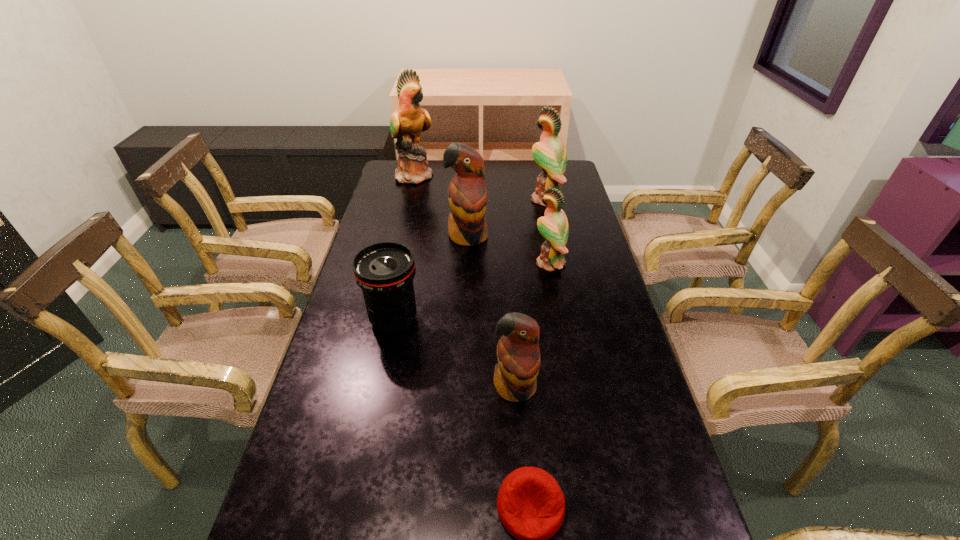
Where is `the biggest green parrot`? the biggest green parrot is located at coordinates (409, 120).

You are a GUI agent. You are given a task and a screenshot of the screen. Output one action in this format:
    pyautogui.click(x=<x>, y=<y>)
    Task: Click on the farthest parrot
    
    Given the screenshot: What is the action you would take?
    pyautogui.click(x=409, y=120)

Where is `the second biggest green parrot`? The height and width of the screenshot is (540, 960). the second biggest green parrot is located at coordinates (550, 154).

Where is `the sixth nearest object`? Image resolution: width=960 pixels, height=540 pixels. the sixth nearest object is located at coordinates (550, 154).

You are a GUI agent. You are given a task and a screenshot of the screen. Output one action in this format:
    pyautogui.click(x=<x>, y=<y>)
    Task: Click on the second parrot from left to right
    
    Given the screenshot: What is the action you would take?
    pyautogui.click(x=467, y=194)

Where is `the bigger red parrot`? the bigger red parrot is located at coordinates (467, 194).

Locate an element on the screen. Image resolution: width=960 pixels, height=540 pixels. the fourth farthest object is located at coordinates (554, 228).

At what (x,y) coordinates should I click in order to perform the action: click on the nearest green parrot. Please return your answer as a coordinate pair (x, y). Looking at the image, I should click on (554, 228).

Locate an element on the screen. The width and height of the screenshot is (960, 540). the second nearest object is located at coordinates [x=518, y=353].

Locate an element on the screen. the nearer red parrot is located at coordinates (518, 353).